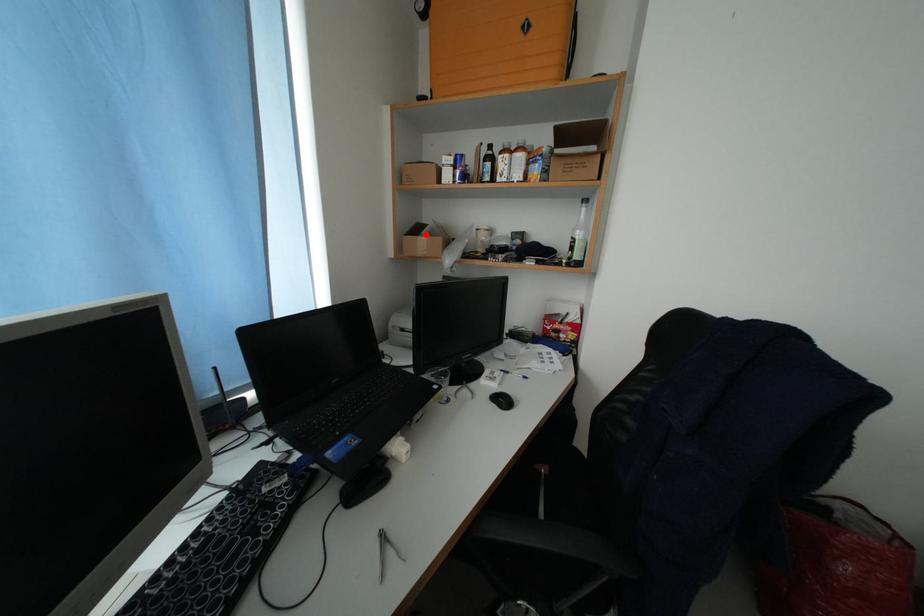
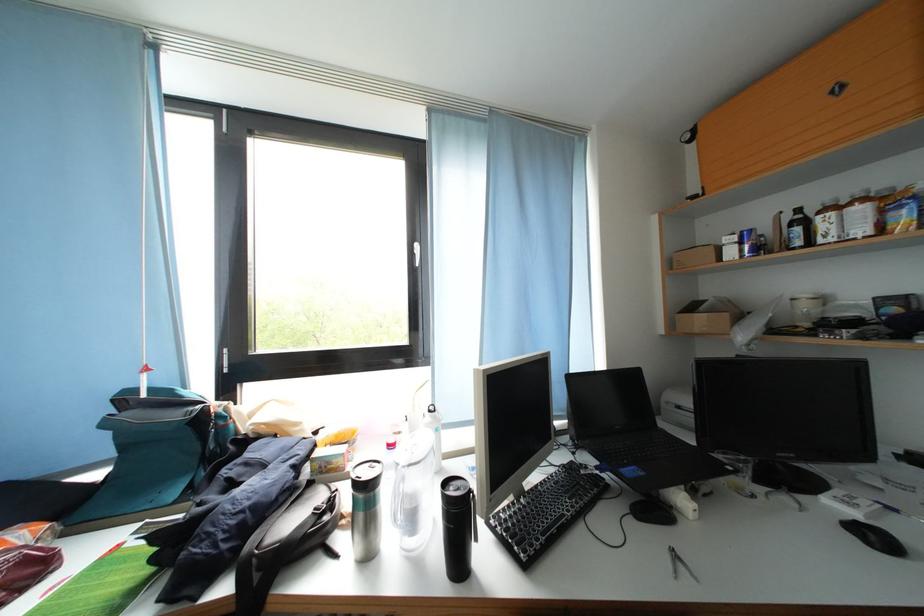
Where in the second image is the point corresponding to the highlighted location from the first image?

(700, 312)